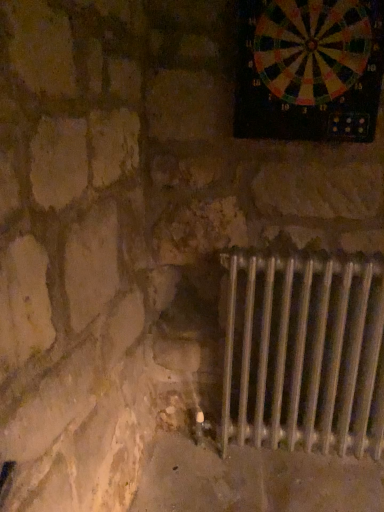
The image size is (384, 512). Describe the element at coordinates (304, 353) in the screenshot. I see `silver metallic radiator at lower right` at that location.

Find the location of a particular element. This screenshot has height=512, width=384. silver metallic radiator at lower right is located at coordinates (304, 353).

Find the location of a particular element. multicolored plastic dartboard at upper right is located at coordinates (311, 48).

What do you see at coordinates (311, 48) in the screenshot?
I see `multicolored plastic dartboard at upper right` at bounding box center [311, 48].

Locate an element on the screen. silver metallic radiator at lower right is located at coordinates point(304,353).

Which object is positioned more to the left, silver metallic radiator at lower right or multicolored plastic dartboard at upper right?

multicolored plastic dartboard at upper right is more to the left.

From the picture: Is silver metallic radiator at lower right closer to the viewer compared to multicolored plastic dartboard at upper right?

No.

Considering the points (262, 368) and (290, 37), which point is in front, point (262, 368) or point (290, 37)?

Point (290, 37)

From the image's perspective, does silver metallic radiator at lower right appear lower than multicolored plastic dartboard at upper right?

Correct, silver metallic radiator at lower right appears lower than multicolored plastic dartboard at upper right in the image.

From a real-world perspective, who is located higher, silver metallic radiator at lower right or multicolored plastic dartboard at upper right?

In real-world perspective, multicolored plastic dartboard at upper right is above.

Does silver metallic radiator at lower right have a greater width compared to multicolored plastic dartboard at upper right?

Correct, the width of silver metallic radiator at lower right exceeds that of multicolored plastic dartboard at upper right.

In terms of height, does silver metallic radiator at lower right look taller or shorter compared to multicolored plastic dartboard at upper right?

In the image, silver metallic radiator at lower right appears to be taller than multicolored plastic dartboard at upper right.

Which of these two, silver metallic radiator at lower right or multicolored plastic dartboard at upper right, is smaller?

Smaller between the two is multicolored plastic dartboard at upper right.

Is multicolored plastic dartboard at upper right completely or partially inside silver metallic radiator at lower right?

That's incorrect, multicolored plastic dartboard at upper right is not inside silver metallic radiator at lower right.

Is silver metallic radiator at lower right placed right next to multicolored plastic dartboard at upper right?

No, silver metallic radiator at lower right is not in contact with multicolored plastic dartboard at upper right.

Is silver metallic radiator at lower right facing towards multicolored plastic dartboard at upper right?

No, silver metallic radiator at lower right does not turn towards multicolored plastic dartboard at upper right.

How many degrees apart are the facing directions of silver metallic radiator at lower right and multicolored plastic dartboard at upper right?

They differ by 1.01 degrees in their facing directions.

Measure the distance from silver metallic radiator at lower right to multicolored plastic dartboard at upper right.

A distance of 30.00 inches exists between silver metallic radiator at lower right and multicolored plastic dartboard at upper right.

The height and width of the screenshot is (512, 384). I want to click on radiator to the right of multicolored plastic dartboard at upper right, so tap(304, 353).

Considering the positions of objects multicolored plastic dartboard at upper right and silver metallic radiator at lower right in the image provided, who is more to the right, multicolored plastic dartboard at upper right or silver metallic radiator at lower right?

silver metallic radiator at lower right is more to the right.

Is multicolored plastic dartboard at upper right positioned before silver metallic radiator at lower right?

Yes, it is in front of silver metallic radiator at lower right.

Is point (307, 14) closer to viewer compared to point (327, 392)?

Yes, it is in front of point (327, 392).

From the image's perspective, would you say multicolored plastic dartboard at upper right is shown under silver metallic radiator at lower right?

No, from the image's perspective, multicolored plastic dartboard at upper right is not beneath silver metallic radiator at lower right.

From a real-world perspective, which object rests below the other?

silver metallic radiator at lower right is physically lower.

Does multicolored plastic dartboard at upper right have a lesser width compared to silver metallic radiator at lower right?

Yes, multicolored plastic dartboard at upper right is thinner than silver metallic radiator at lower right.

Is multicolored plastic dartboard at upper right taller or shorter than silver metallic radiator at lower right?

Clearly, multicolored plastic dartboard at upper right is shorter compared to silver metallic radiator at lower right.

Which of these two, multicolored plastic dartboard at upper right or silver metallic radiator at lower right, is smaller?

multicolored plastic dartboard at upper right.

Is multicolored plastic dartboard at upper right inside or outside of silver metallic radiator at lower right?

multicolored plastic dartboard at upper right exists outside the volume of silver metallic radiator at lower right.

Is multicolored plastic dartboard at upper right placed right next to silver metallic radiator at lower right?

No, multicolored plastic dartboard at upper right is not with silver metallic radiator at lower right.

Is multicolored plastic dartboard at upper right oriented away from silver metallic radiator at lower right?

That's not correct — multicolored plastic dartboard at upper right is not looking away from silver metallic radiator at lower right.

Can you tell me how much multicolored plastic dartboard at upper right and silver metallic radiator at lower right differ in facing direction?

The facing directions of multicolored plastic dartboard at upper right and silver metallic radiator at lower right are 1.01 degrees apart.

Locate an element on the screen. radiator below the multicolored plastic dartboard at upper right (from the image's perspective) is located at coordinates (304, 353).

Find the location of a particular element. The image size is (384, 512). radiator below the multicolored plastic dartboard at upper right (from a real-world perspective) is located at coordinates (304, 353).

The width and height of the screenshot is (384, 512). I want to click on wheel in front of the silver metallic radiator at lower right, so click(311, 48).